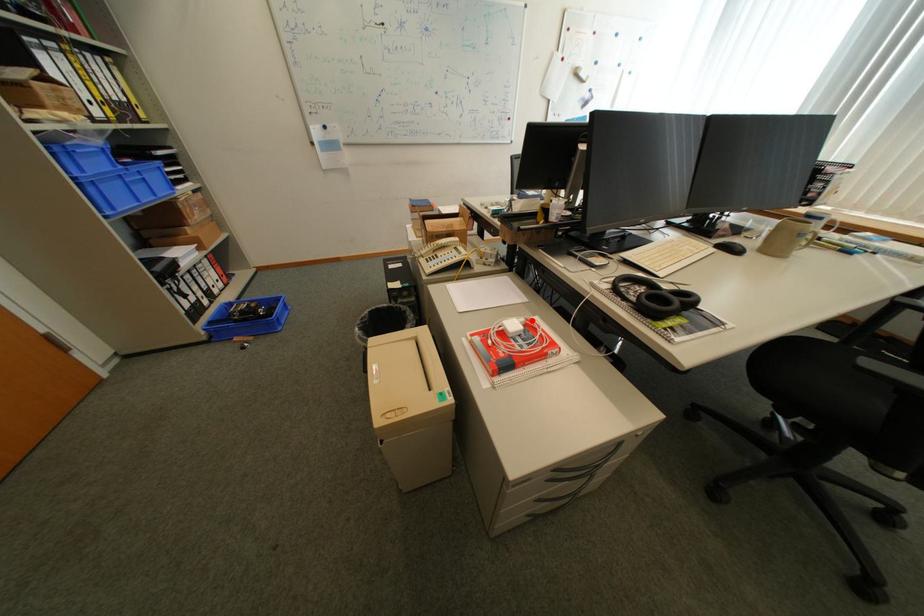
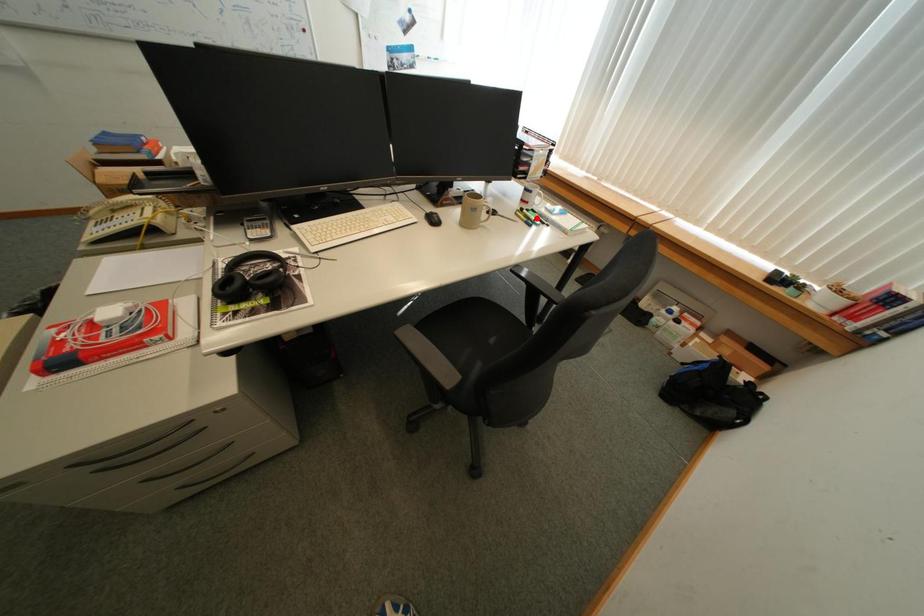
I am providing you with two images of the same scene from different viewpoints. A red point is marked on the first image and another point is marked on the second image. Is the red point in image1 aligned with the point shown in image2?

A: No